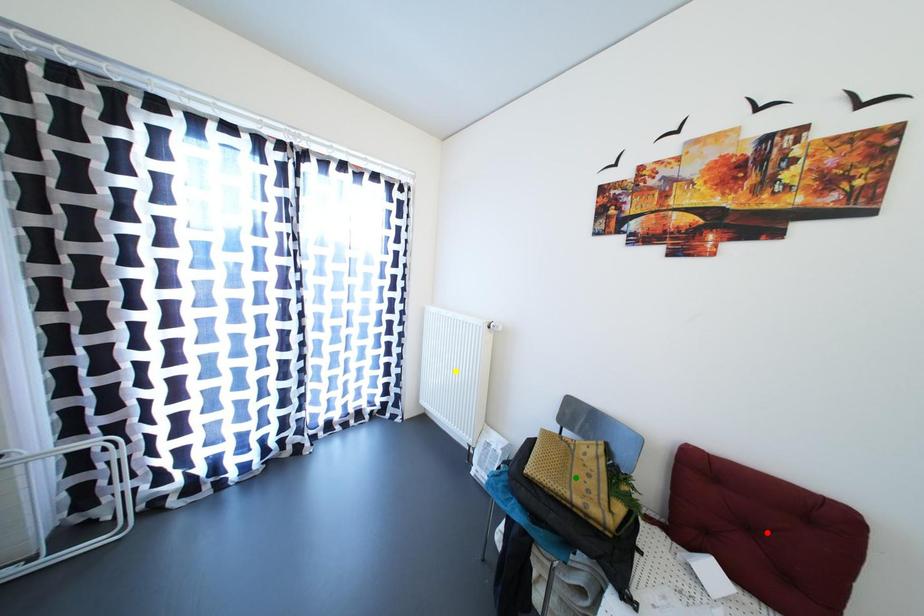
From the picture: Order these from nearest to farthest:
yellow point
green point
red point

red point, green point, yellow point